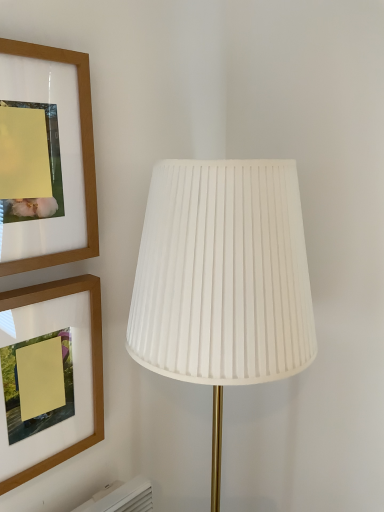
Question: Considering the relative positions of wooden picture frame at upper left, the first picture frame in the bottom-to-top sequence, and wooden picture frame at upper left, which is the second picture frame from bottom to top, in the image provided, is wooden picture frame at upper left, the first picture frame in the bottom-to-top sequence, to the right of wooden picture frame at upper left, which is the second picture frame from bottom to top, from the viewer's perspective?

Choices:
 (A) yes
 (B) no

Answer: (A)

Question: Does wooden picture frame at upper left, which is the second picture frame from top to bottom, have a smaller size compared to wooden picture frame at upper left, marked as the 1th picture frame in a top-to-bottom arrangement?

Choices:
 (A) yes
 (B) no

Answer: (B)

Question: Does wooden picture frame at upper left, which is the second picture frame from top to bottom, come behind wooden picture frame at upper left, marked as the 1th picture frame in a top-to-bottom arrangement?

Choices:
 (A) no
 (B) yes

Answer: (B)

Question: Is wooden picture frame at upper left, marked as the 1th picture frame in a top-to-bottom arrangement, at the back of wooden picture frame at upper left, the first picture frame in the bottom-to-top sequence?

Choices:
 (A) yes
 (B) no

Answer: (B)

Question: From the image's perspective, does wooden picture frame at upper left, which is the second picture frame from top to bottom, appear lower than wooden picture frame at upper left, which is the second picture frame from bottom to top?

Choices:
 (A) no
 (B) yes

Answer: (B)

Question: Is wooden picture frame at upper left, which is the second picture frame from top to bottom, not close to wooden picture frame at upper left, marked as the 1th picture frame in a top-to-bottom arrangement?

Choices:
 (A) no
 (B) yes

Answer: (A)

Question: From the image's perspective, is wooden picture frame at upper left, marked as the 1th picture frame in a top-to-bottom arrangement, over wooden picture frame at upper left, the first picture frame in the bottom-to-top sequence?

Choices:
 (A) no
 (B) yes

Answer: (B)

Question: Considering the relative sizes of wooden picture frame at upper left, which is the second picture frame from bottom to top, and wooden picture frame at upper left, which is the second picture frame from top to bottom, in the image provided, is wooden picture frame at upper left, which is the second picture frame from bottom to top, wider than wooden picture frame at upper left, which is the second picture frame from top to bottom,?

Choices:
 (A) no
 (B) yes

Answer: (A)

Question: Is wooden picture frame at upper left, which is the second picture frame from bottom to top, looking in the opposite direction of wooden picture frame at upper left, the first picture frame in the bottom-to-top sequence?

Choices:
 (A) yes
 (B) no

Answer: (B)

Question: Does wooden picture frame at upper left, marked as the 1th picture frame in a top-to-bottom arrangement, appear on the left side of wooden picture frame at upper left, the first picture frame in the bottom-to-top sequence?

Choices:
 (A) no
 (B) yes

Answer: (B)

Question: From the image's perspective, does wooden picture frame at upper left, marked as the 1th picture frame in a top-to-bottom arrangement, appear lower than wooden picture frame at upper left, the first picture frame in the bottom-to-top sequence?

Choices:
 (A) yes
 (B) no

Answer: (B)

Question: Is wooden picture frame at upper left, marked as the 1th picture frame in a top-to-bottom arrangement, bigger than wooden picture frame at upper left, the first picture frame in the bottom-to-top sequence?

Choices:
 (A) yes
 (B) no

Answer: (B)

Question: Is white pleated fabric lamp at center at the right side of wooden picture frame at upper left, the first picture frame in the bottom-to-top sequence?

Choices:
 (A) no
 (B) yes

Answer: (B)